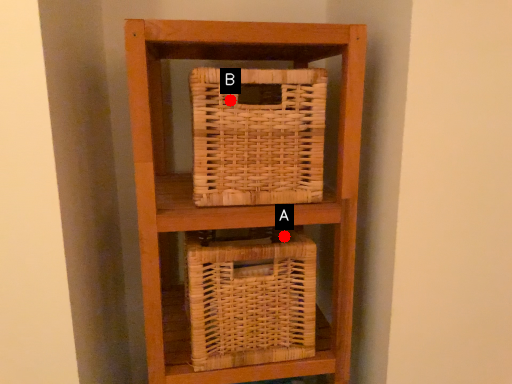
Question: Two points are circled on the image, labeled by A and B beside each circle. Which point appears farthest from the camera in this image?

Choices:
 (A) A is further
 (B) B is further

Answer: (A)